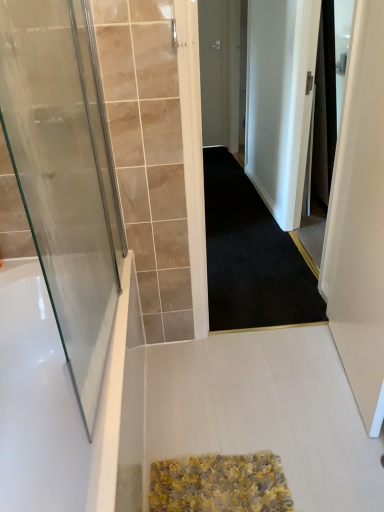
Question: Is white matte screen door at right at the left side of black carpet at center?

Choices:
 (A) no
 (B) yes

Answer: (A)

Question: From the image's perspective, is white matte screen door at right beneath black carpet at center?

Choices:
 (A) yes
 (B) no

Answer: (A)

Question: Is white matte screen door at right located outside black carpet at center?

Choices:
 (A) no
 (B) yes

Answer: (B)

Question: From a real-world perspective, does white matte screen door at right stand above black carpet at center?

Choices:
 (A) yes
 (B) no

Answer: (A)

Question: Could black carpet at center be considered to be inside white matte screen door at right?

Choices:
 (A) yes
 (B) no

Answer: (B)

Question: Is matte gray door at center, marked as the second door in a left-to-right arrangement, taller or shorter than white glossy bathtub at left?

Choices:
 (A) tall
 (B) short

Answer: (A)

Question: Which is correct: matte gray door at center, the 1th door from the right, is inside white glossy bathtub at left, or outside of it?

Choices:
 (A) inside
 (B) outside

Answer: (B)

Question: From the image's perspective, relative to white glossy bathtub at left, is matte gray door at center, the 2th door positioned from the front, above or below?

Choices:
 (A) above
 (B) below

Answer: (A)

Question: Considering the positions of point (216, 117) and point (66, 479), is point (216, 117) closer or farther from the camera than point (66, 479)?

Choices:
 (A) farther
 (B) closer

Answer: (A)

Question: In terms of size, does transparent glass door at left, arranged as the 1th door when viewed from the front, appear bigger or smaller than black carpet at center?

Choices:
 (A) small
 (B) big

Answer: (A)

Question: Considering the positions of point (41, 267) and point (210, 205), is point (41, 267) closer or farther from the camera than point (210, 205)?

Choices:
 (A) closer
 (B) farther

Answer: (A)

Question: Considering the relative positions of transparent glass door at left, placed as the 2th door when sorted from back to front, and black carpet at center in the image provided, is transparent glass door at left, placed as the 2th door when sorted from back to front, to the left or to the right of black carpet at center?

Choices:
 (A) left
 (B) right

Answer: (A)

Question: In terms of width, does transparent glass door at left, acting as the 2th door starting from the top, look wider or thinner when compared to black carpet at center?

Choices:
 (A) thin
 (B) wide

Answer: (A)

Question: Relative to matte gray door at center, marked as the second door in a left-to-right arrangement, is white glossy bathtub at left in front or behind?

Choices:
 (A) behind
 (B) front

Answer: (B)

Question: Would you say white glossy bathtub at left is inside or outside matte gray door at center, the 2th door positioned from the front?

Choices:
 (A) outside
 (B) inside

Answer: (A)